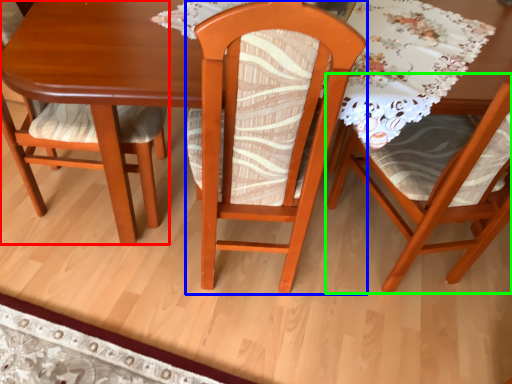
Question: Which object is positioned farthest from chair (highlighted by a red box)? Select from chair (highlighted by a blue box) and chair (highlighted by a green box).

Choices:
 (A) chair
 (B) chair

Answer: (B)